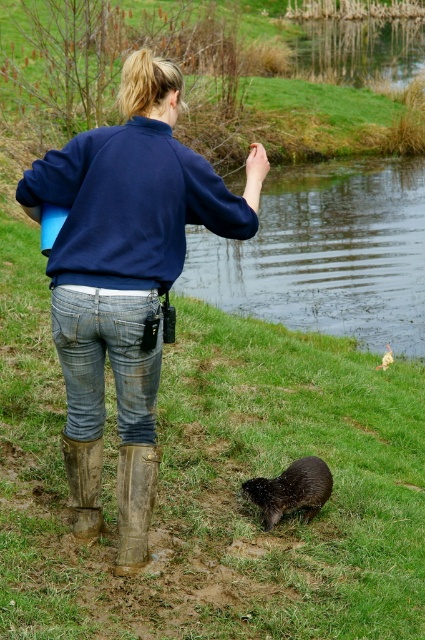
Question: Is green grass at lower center positioned at the back of blue cotton sweater at center?

Choices:
 (A) no
 (B) yes

Answer: (B)

Question: Which point is farther to the camera?

Choices:
 (A) (388, 323)
 (B) (339, 358)
 (C) (81, 531)

Answer: (A)

Question: Is blue cotton sweater at center to the right of shiny brown otter at lower center from the viewer's perspective?

Choices:
 (A) yes
 (B) no

Answer: (B)

Question: Which of these objects is positioned farthest from the muddy rubber boot at lower left?

Choices:
 (A) brown rubber boot at lower left
 (B) blue cotton sweater at center
 (C) shiny brown otter at lower center
 (D) green grass at lower center

Answer: (D)

Question: From the image, what is the correct spatial relationship of green grass at lower center in relation to blue cotton sweater at center?

Choices:
 (A) below
 (B) above

Answer: (A)

Question: Which object is the closest to the shiny brown otter at lower center?

Choices:
 (A) muddy rubber boot at lower left
 (B) brown rubber boot at lower left
 (C) blue cotton sweater at center
 (D) green grass at lower center

Answer: (D)